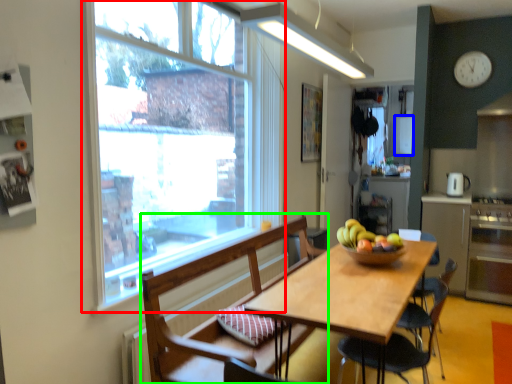
Question: Which object is the farthest from window (highlighted by a red box)? Choose among these: appliance (highlighted by a blue box) or chair (highlighted by a green box).

Choices:
 (A) appliance
 (B) chair

Answer: (A)